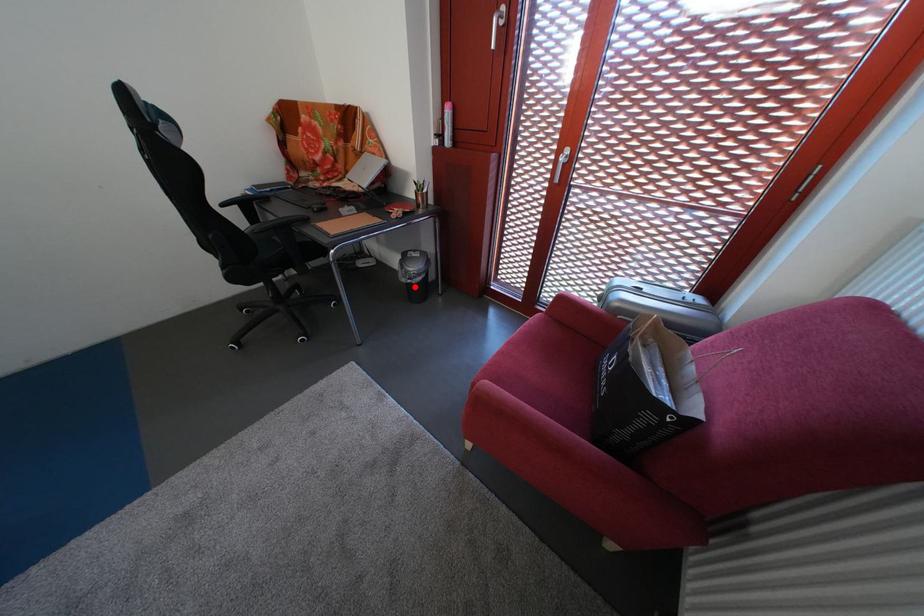
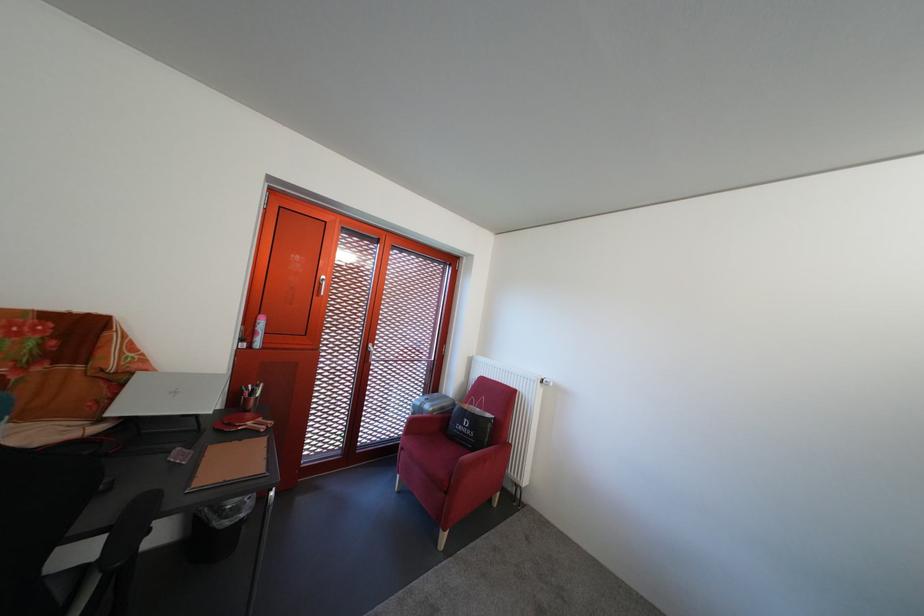
Question: A red point is marked in image1. In image2, is the corresponding 3D point closer to the camera or farther? Reply with the corresponding letter.

Choices:
 (A) The corresponding 3D point is closer.
 (B) The corresponding 3D point is farther.

Answer: (B)